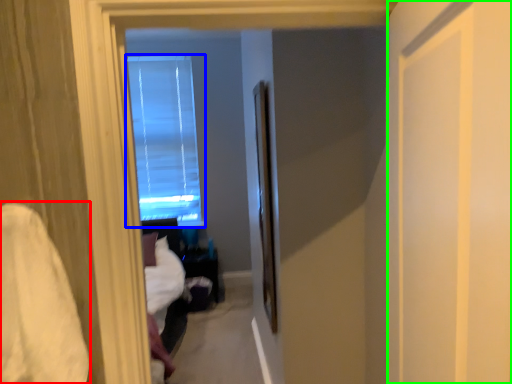
Question: Estimate the real-world distances between objects in this image. Which object is closer to sheet (highlighted by a red box), window (highlighted by a blue box) or screen door (highlighted by a green box)?

Choices:
 (A) window
 (B) screen door

Answer: (B)